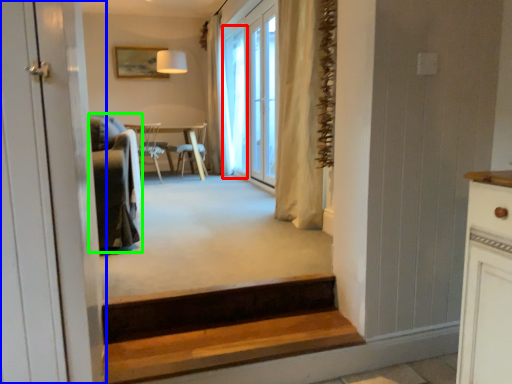
Question: Estimate the real-world distances between objects in this image. Which object is closer to window screen (highlighted by a red box), door (highlighted by a blue box) or armchair (highlighted by a green box)?

Choices:
 (A) door
 (B) armchair

Answer: (B)